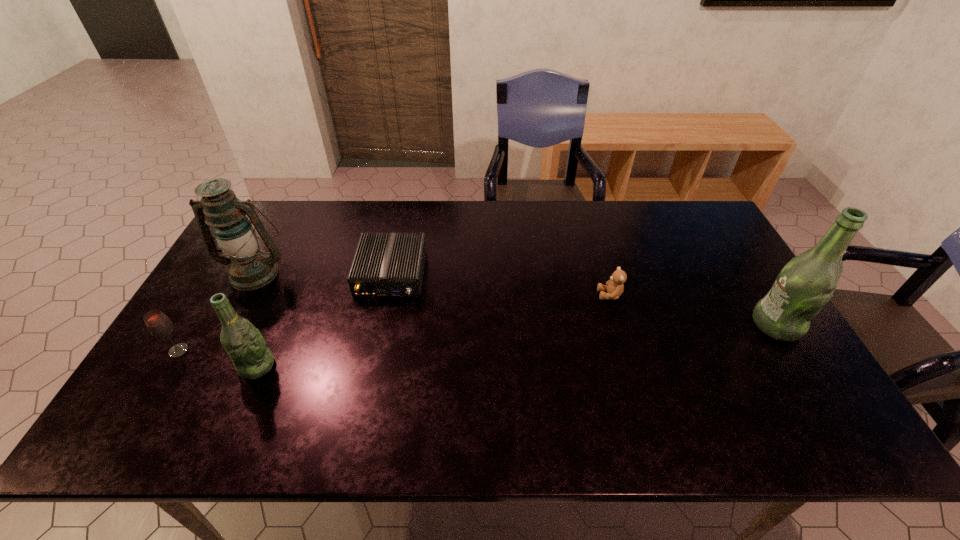
Locate an element on the screen. the shorter beer bottle is located at coordinates (243, 342).

Identify the location of the left beer bottle. (243, 342).

Image resolution: width=960 pixels, height=540 pixels. Identify the location of the rightmost object. (806, 283).

At what (x,y) coordinates should I click in order to perform the action: click on the farther beer bottle. Please return your answer as a coordinate pair (x, y). The width and height of the screenshot is (960, 540). Looking at the image, I should click on (806, 283).

The image size is (960, 540). Identify the location of the third object from right to left. (392, 265).

The image size is (960, 540). I want to click on router, so click(x=392, y=265).

You are a GUI agent. You are given a task and a screenshot of the screen. Output one action in this format:
    pyautogui.click(x=<x>, y=<y>)
    Task: Click on the second shortest object
    
    Given the screenshot: What is the action you would take?
    pyautogui.click(x=614, y=287)

The width and height of the screenshot is (960, 540). What are the coordinates of `teddy bear` in the screenshot? It's located at (614, 287).

You are a GUI agent. You are given a task and a screenshot of the screen. Output one action in this format:
    pyautogui.click(x=<x>, y=<y>)
    Task: Click on the fifth shortest object
    
    Given the screenshot: What is the action you would take?
    pyautogui.click(x=249, y=268)

Image resolution: width=960 pixels, height=540 pixels. In order to click on the fourth tallest object in this screenshot , I will do `click(158, 324)`.